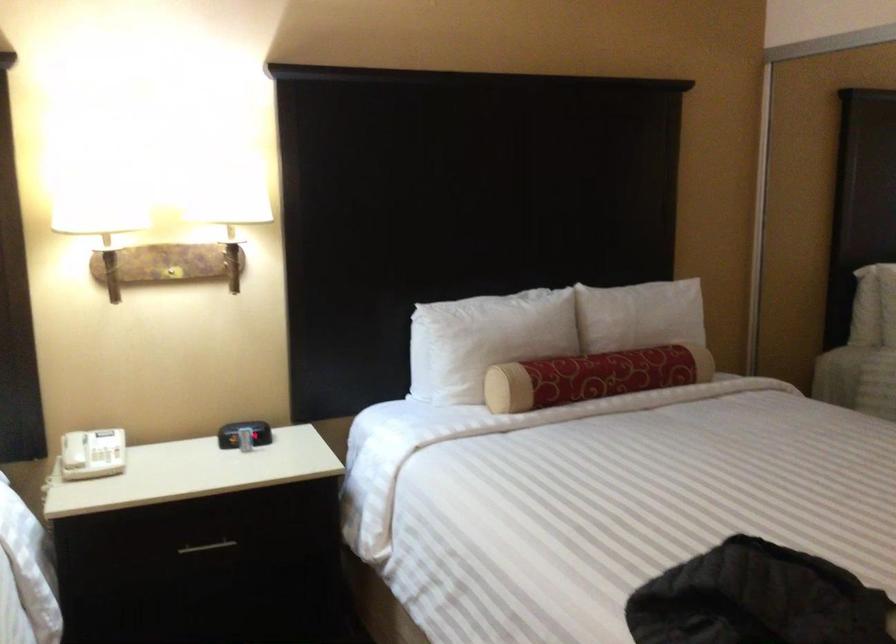
Where is `alarm clock buttons`? The height and width of the screenshot is (644, 896). alarm clock buttons is located at coordinates (244, 433).